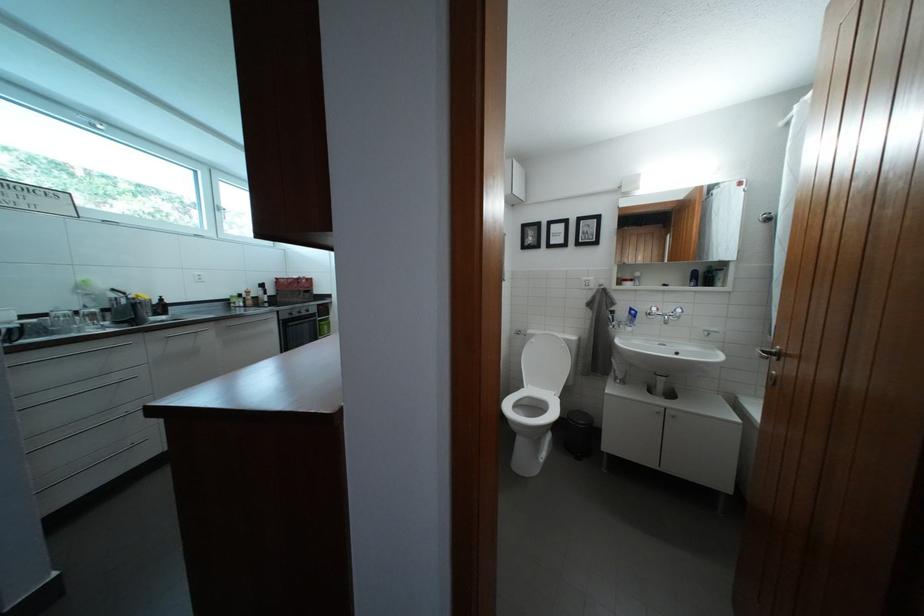
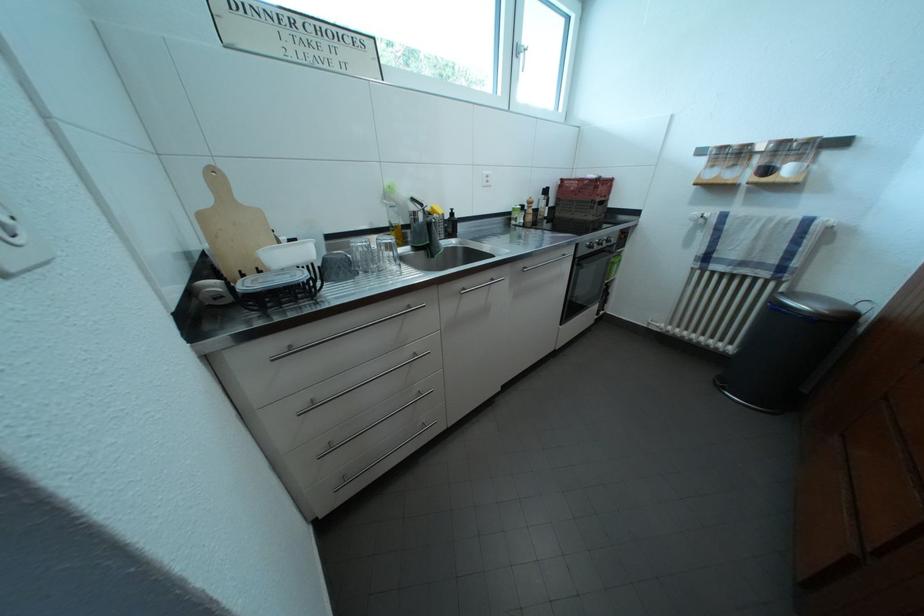
In the second image, find the point that corresponds to [286,318] in the first image.

(587, 251)